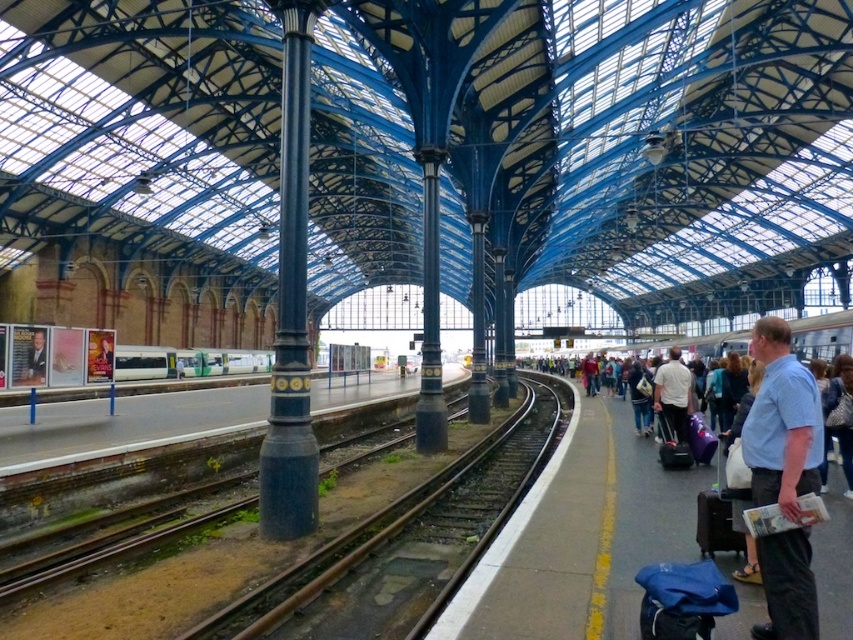
Question: Which object is farther from the camera taking this photo?

Choices:
 (A) blue fabric suitcase at right
 (B) black fabric suitcase at right
 (C) smooth black suit at left

Answer: (C)

Question: Which point is closer to the camera?

Choices:
 (A) black hard suitcase at center-right
 (B) smooth black suit at left

Answer: (A)

Question: In this image, where is polished dark blue column at center located relative to light blue shirt at right?

Choices:
 (A) above
 (B) below

Answer: (A)

Question: Can you confirm if polished dark blue column at center is positioned to the left of blue denim jacket at center?

Choices:
 (A) no
 (B) yes

Answer: (B)

Question: Can you confirm if brown gravel train track at center is bigger than blue denim jacket at center?

Choices:
 (A) no
 (B) yes

Answer: (B)

Question: Which point is farther to the camera?

Choices:
 (A) (280, 150)
 (B) (264, 365)

Answer: (B)